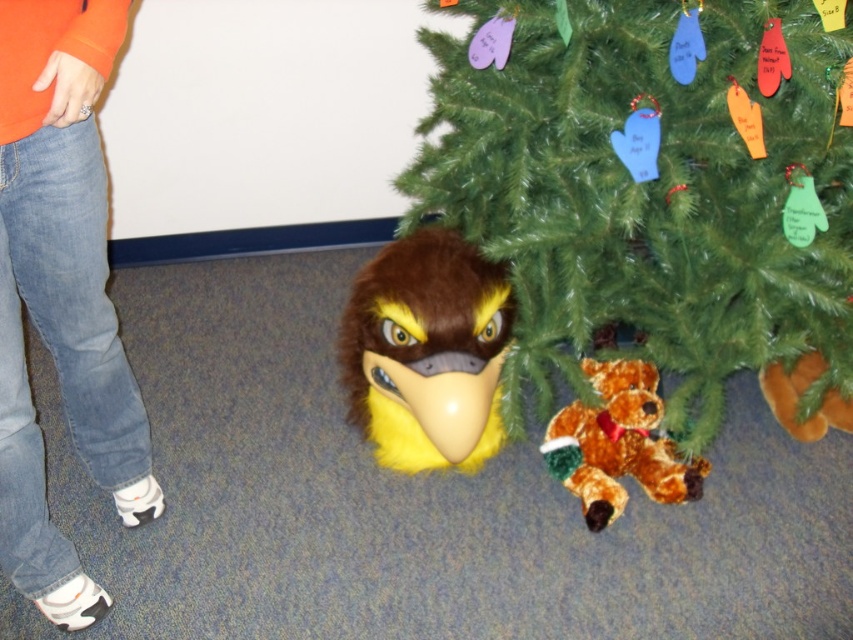
Question: Is fluffy yellow bird at center above brown plush bear at lower center?

Choices:
 (A) no
 (B) yes

Answer: (B)

Question: Which point is farther to the camera?

Choices:
 (A) (468, 429)
 (B) (625, 392)

Answer: (B)

Question: Can you confirm if green matte christmas tree at center is positioned to the right of fluffy yellow bird at center?

Choices:
 (A) no
 (B) yes

Answer: (B)

Question: Is green matte christmas tree at center in front of brown plush bear at lower center?

Choices:
 (A) no
 (B) yes

Answer: (B)

Question: Which point is farther to the camera?

Choices:
 (A) green matte christmas tree at center
 (B) fluffy yellow bird at center
 (C) brown plush bear at lower center

Answer: (C)

Question: Which of the following is the farthest from the observer?

Choices:
 (A) green matte christmas tree at center
 (B) fluffy yellow bird at center

Answer: (B)